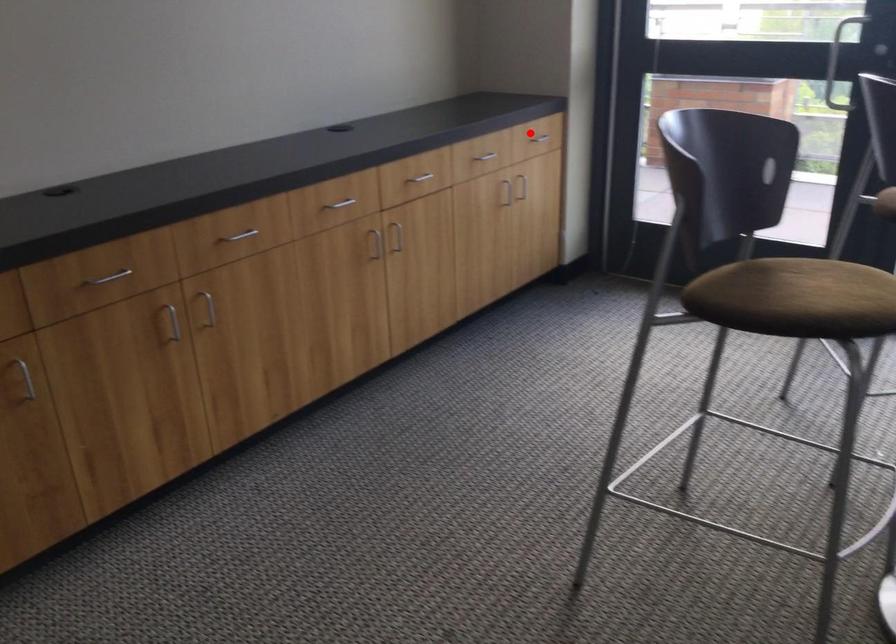
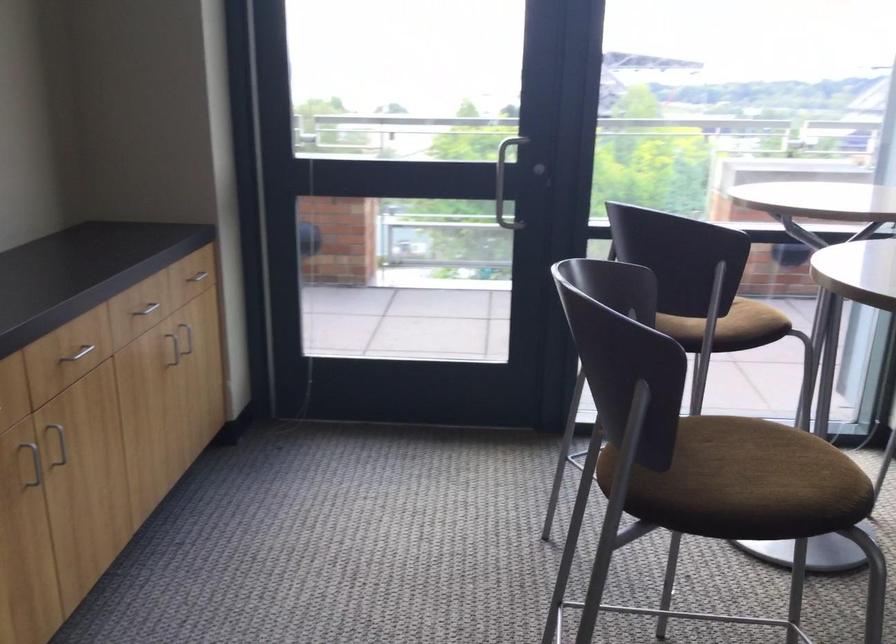
Question: I am providing you with two images of the same scene from different viewpoints. A red point is shown in image1. For the corresponding object point in image2, is it positioned nearer or farther from the camera?

Choices:
 (A) Nearer
 (B) Farther

Answer: (A)